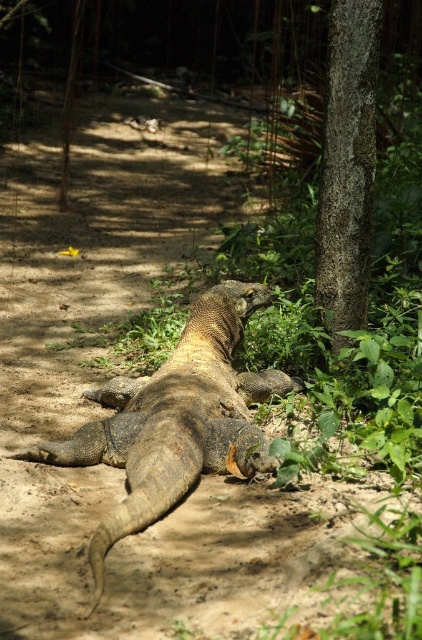
You are a photographer standing at the point closest to the Komodo dragon in the image. You want to capture a photo of the two points labeled as point (x=208, y=296) and point (x=340, y=132). Which point should you focus on first if you want to ensure both points are in sharp focus?

You should focus on point (x=208, y=296) first because it is closer to the camera than point (x=340, y=132). By focusing on the closer point, the farther point may still be within the depth of field, ensuring both are sharp.

You are a hiker who wants to take a photo of the leathery brown lizard at center and the smooth bark tree trunk at right. Which object is closer to the ground?

The leathery brown lizard at center is below the smooth bark tree trunk at right, so it is closer to the ground.

You are a hiker who wants to take a photo of the leathery brown lizard at center and the smooth bark tree trunk at right. Which object is wider in the image?

The leathery brown lizard at center might be wider than smooth bark tree trunk at right according to the description.